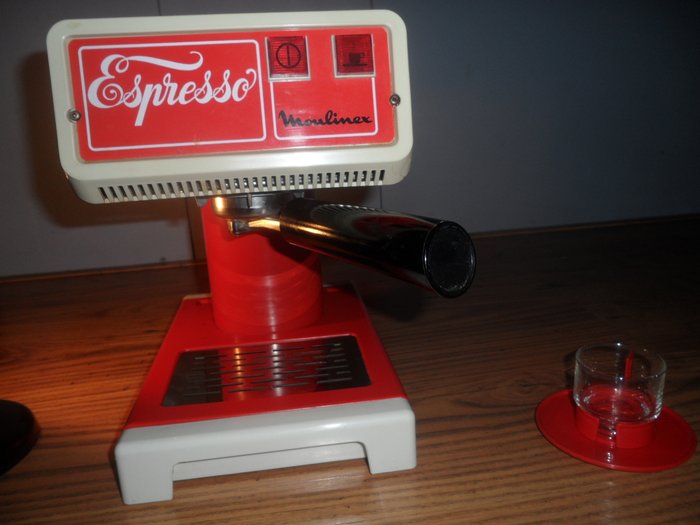
Locate an element on the screen. This screenshot has height=525, width=700. coffee machine is located at coordinates (315, 115).